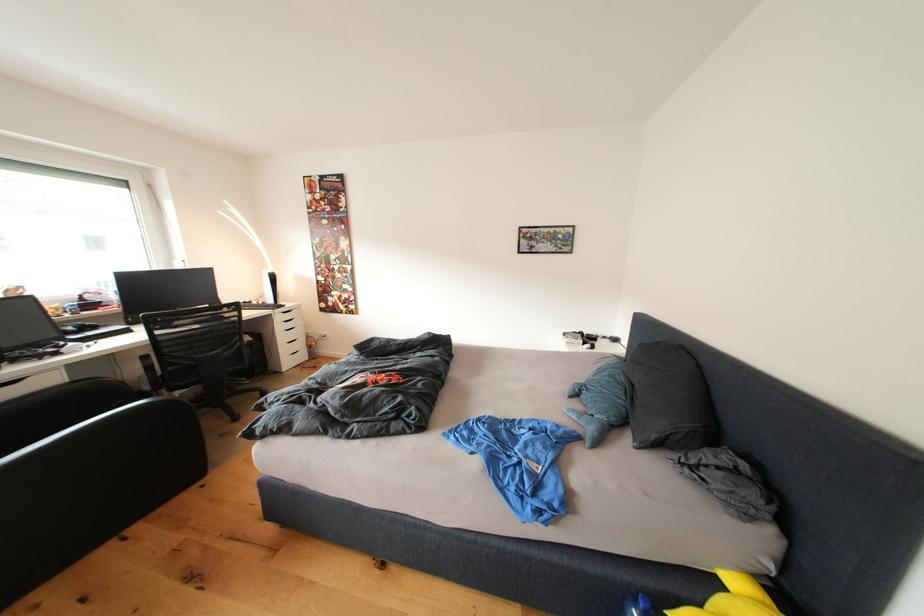
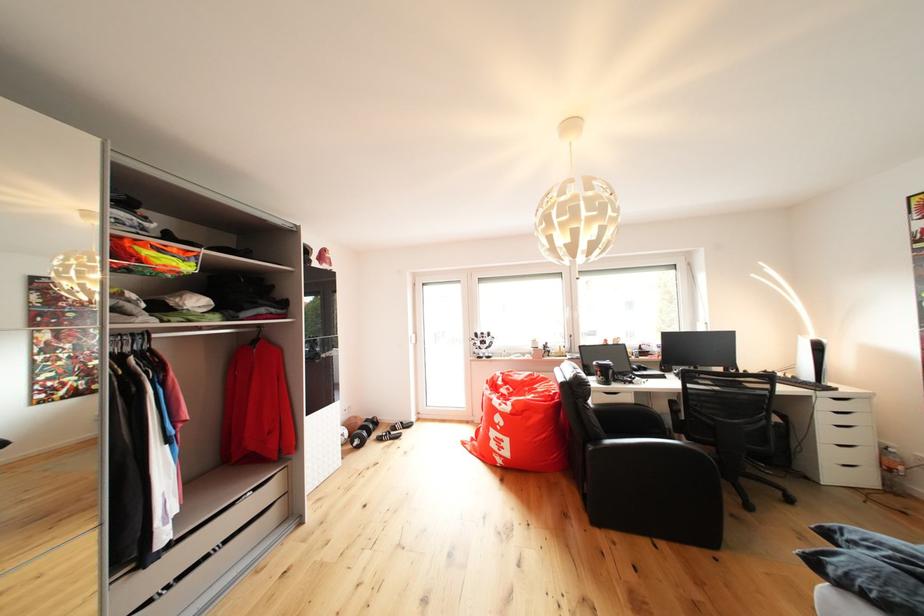
Find the pixel in the second image that matches point 298,360 in the first image.

(846, 469)